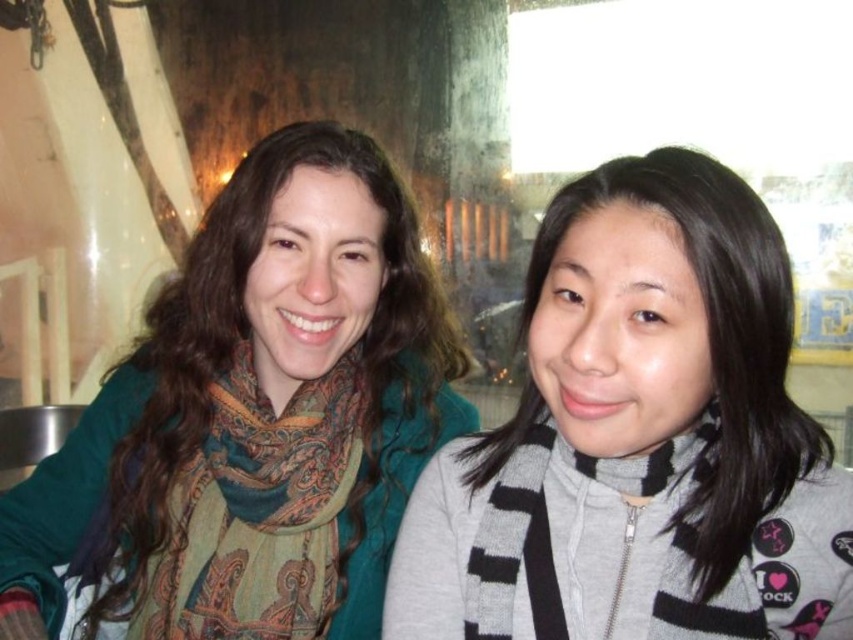
You are standing in the image and want to reach the point at the bottom right corner. Which point, point at (225, 493) or point at (503, 572), is closer to your current position?

Point at (503, 572) is closer to your current position because it is in front of point at (225, 493).